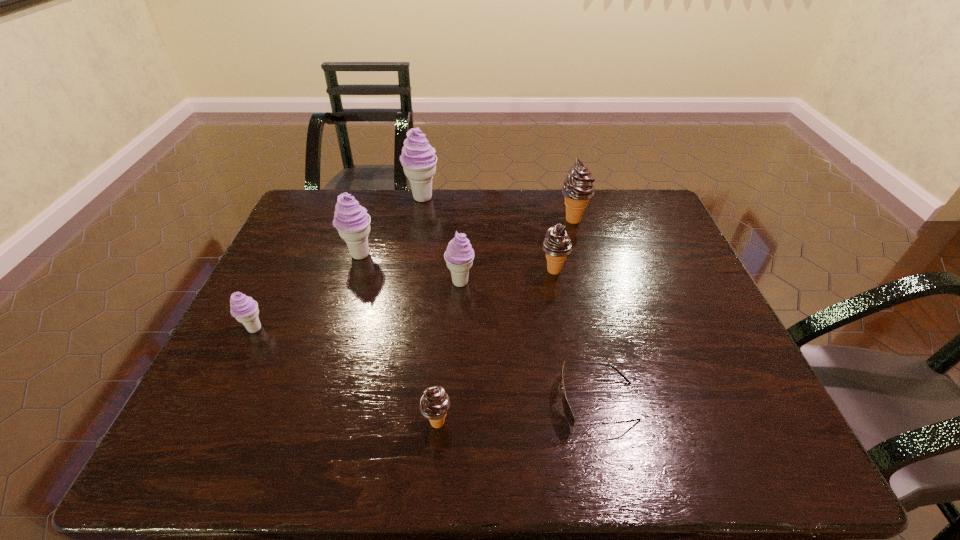
In the image, there is a desktop. Identify the location of blank space at the left edge. This screenshot has width=960, height=540. (325, 255).

In order to click on vacant space at the right edge of the desktop in this screenshot , I will do `click(652, 246)`.

Identify the location of vacant space at the far left corner of the desktop. The width and height of the screenshot is (960, 540). (311, 200).

You are a GUI agent. You are given a task and a screenshot of the screen. Output one action in this format:
    pyautogui.click(x=<x>, y=<y>)
    Task: Click on the vacant space at the far right corner
    The width and height of the screenshot is (960, 540).
    Given the screenshot: What is the action you would take?
    pyautogui.click(x=619, y=199)

Identify the location of free space between the second biggest purple icecream and the biggest chocolate icecream. click(x=467, y=237).

Image resolution: width=960 pixels, height=540 pixels. In order to click on empty space that is in between the nearest icecream and the farthest purple icecream in this screenshot , I will do (x=429, y=310).

The image size is (960, 540). Identify the location of vacant space that is in between the second biggest chocolate icecream and the third biggest purple icecream. (507, 276).

This screenshot has height=540, width=960. I want to click on free area in between the second smallest purple icecream and the second object from left to right, so click(410, 268).

Where is `free point between the rightmost chocolate icecream and the third smallest purple icecream`? The height and width of the screenshot is (540, 960). free point between the rightmost chocolate icecream and the third smallest purple icecream is located at coordinates (467, 237).

Image resolution: width=960 pixels, height=540 pixels. Identify the location of free space between the smallest purple icecream and the leftmost chocolate icecream. (346, 376).